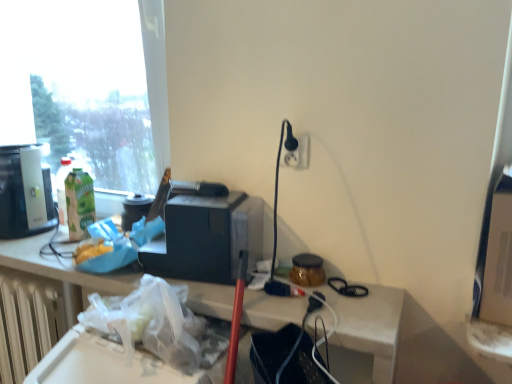
Question: From the image's perspective, relative to matte black coffee machine at left, is white plastic electric outlet at upper right above or below?

Choices:
 (A) above
 (B) below

Answer: (A)

Question: Based on their positions, is white plastic electric outlet at upper right located to the left or right of matte black coffee machine at left?

Choices:
 (A) right
 (B) left

Answer: (A)

Question: Which is nearer to the translucent plastic bag at lower center?

Choices:
 (A) matte black coffee machine at left
 (B) white plastic electric outlet at upper right
 (C) transparent glass window at upper left
 (D) black plastic toaster at center, which is the second appliance in right-to-left order
 (E) translucent glass jar at center, positioned as the 2th appliance in left-to-right order

Answer: (D)

Question: Considering the real-world distances, which object is closest to the matte black coffee machine at left?

Choices:
 (A) white plastic radiator at lower left
 (B) translucent plastic bag at lower center
 (C) black plastic toaster at center, which is the 1th appliance in left-to-right order
 (D) translucent glass jar at center, positioned as the 2th appliance in left-to-right order
 (E) transparent glass window at upper left

Answer: (A)